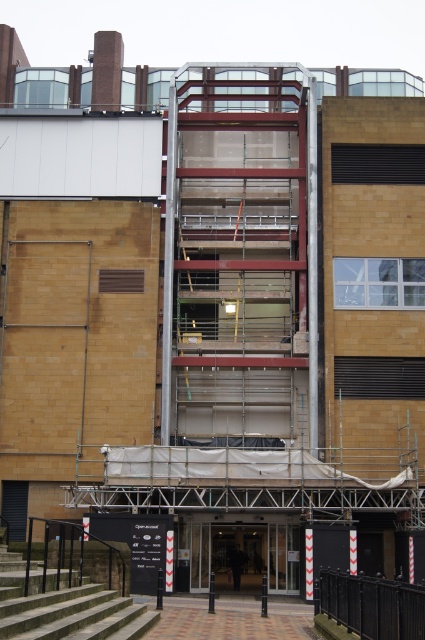
Is metallic scaffolding at center wider than black metal fence at lower right?

Correct, the width of metallic scaffolding at center exceeds that of black metal fence at lower right.

Who is more forward, (190, 416) or (374, 595)?

Point (374, 595) is in front.

You are a GUI agent. You are given a task and a screenshot of the screen. Output one action in this format:
    pyautogui.click(x=<x>, y=<y>)
    Task: Click on the metallic scaffolding at center
    The image size is (425, 640).
    Given the screenshot: What is the action you would take?
    pyautogui.click(x=240, y=257)

Between concrete stairs at lower left and black metal fence at lower right, which one is positioned lower?

black metal fence at lower right is lower down.

Based on the photo, measure the distance from concrete stairs at lower left to black metal fence at lower right.

The distance of concrete stairs at lower left from black metal fence at lower right is 30.49 feet.

Locate an element on the screen. The image size is (425, 640). concrete stairs at lower left is located at coordinates (62, 604).

Looking at this image, does metallic scaffolding at center come in front of concrete stairs at lower left?

That is False.

Which is below, metallic scaffolding at center or concrete stairs at lower left?

concrete stairs at lower left is lower down.

Describe the element at coordinates (240, 257) in the screenshot. This screenshot has height=640, width=425. I see `metallic scaffolding at center` at that location.

Where is `metallic scaffolding at center`? The height and width of the screenshot is (640, 425). metallic scaffolding at center is located at coordinates (240, 257).